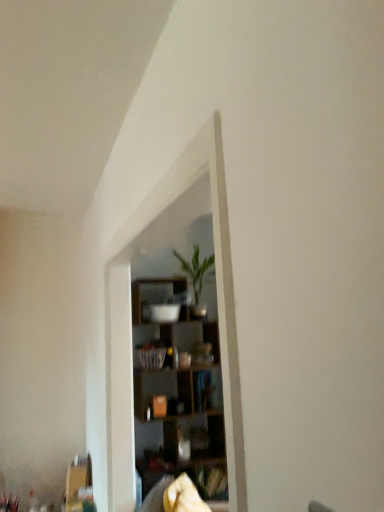
Question: Is green leafy plant at center to the left of wooden shelves at center from the viewer's perspective?

Choices:
 (A) yes
 (B) no

Answer: (B)

Question: From the image's perspective, is green leafy plant at center under wooden shelves at center?

Choices:
 (A) no
 (B) yes

Answer: (A)

Question: Is green leafy plant at center located outside wooden shelves at center?

Choices:
 (A) no
 (B) yes

Answer: (B)

Question: Can you confirm if green leafy plant at center is wider than wooden shelves at center?

Choices:
 (A) yes
 (B) no

Answer: (B)

Question: Does green leafy plant at center turn towards wooden shelves at center?

Choices:
 (A) yes
 (B) no

Answer: (A)

Question: Is green leafy plant at center surrounding wooden shelves at center?

Choices:
 (A) no
 (B) yes

Answer: (A)

Question: Is wooden shelves at center in front of green leafy plant at center?

Choices:
 (A) no
 (B) yes

Answer: (B)

Question: Is wooden shelves at center facing towards green leafy plant at center?

Choices:
 (A) no
 (B) yes

Answer: (A)

Question: Is wooden shelves at center positioned far away from green leafy plant at center?

Choices:
 (A) no
 (B) yes

Answer: (A)

Question: Is green leafy plant at center completely or partially inside wooden shelves at center?

Choices:
 (A) no
 (B) yes

Answer: (B)

Question: Does wooden shelves at center have a lesser width compared to green leafy plant at center?

Choices:
 (A) no
 (B) yes

Answer: (A)

Question: Is wooden shelves at center bigger than green leafy plant at center?

Choices:
 (A) yes
 (B) no

Answer: (A)

Question: Based on their sizes in the image, would you say green leafy plant at center is bigger or smaller than wooden shelves at center?

Choices:
 (A) big
 (B) small

Answer: (B)